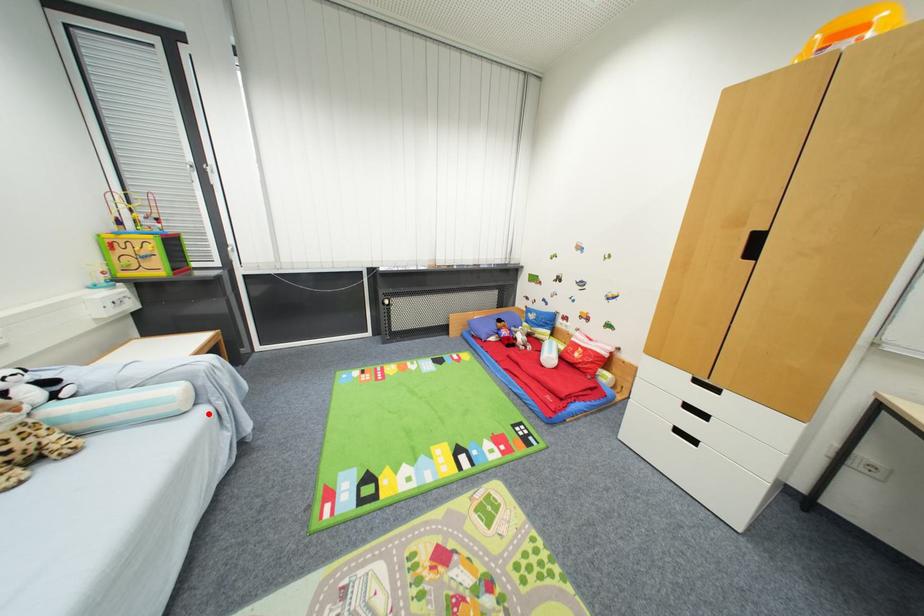
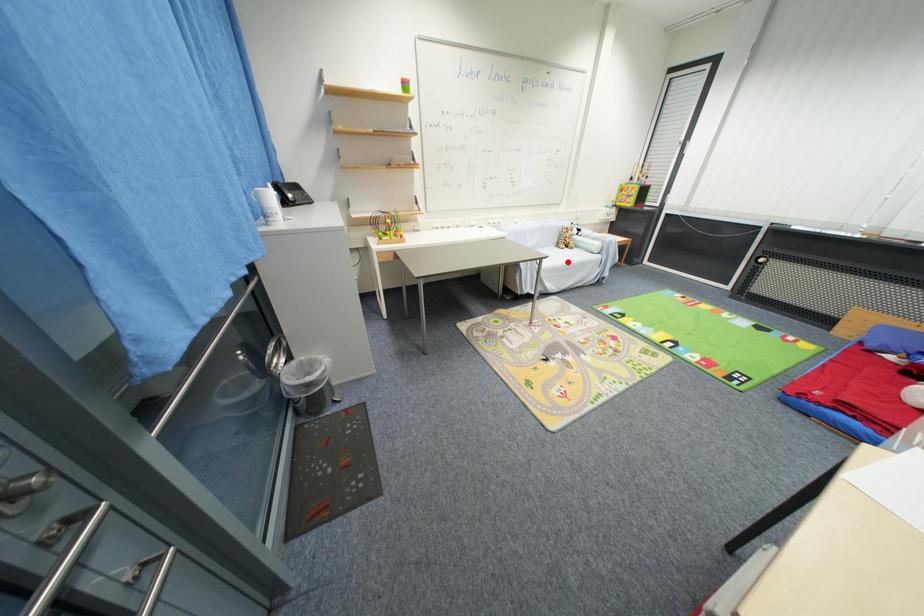
I am providing you with two images of the same scene from different viewpoints. A red point is marked on the first image and another point is marked on the second image. Is the red point in image1 aligned with the point shown in image2?

No